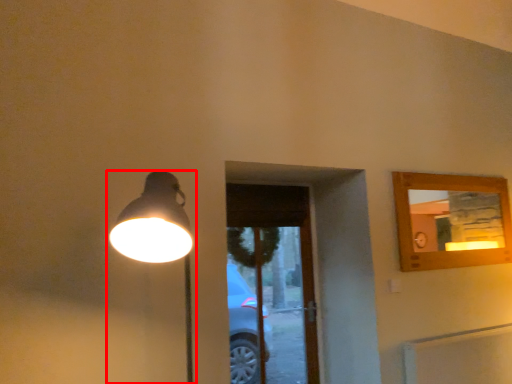
Question: From the image, what is the correct spatial relationship of lamp (annotated by the red box) in relation to screen door?

Choices:
 (A) left
 (B) right

Answer: (A)